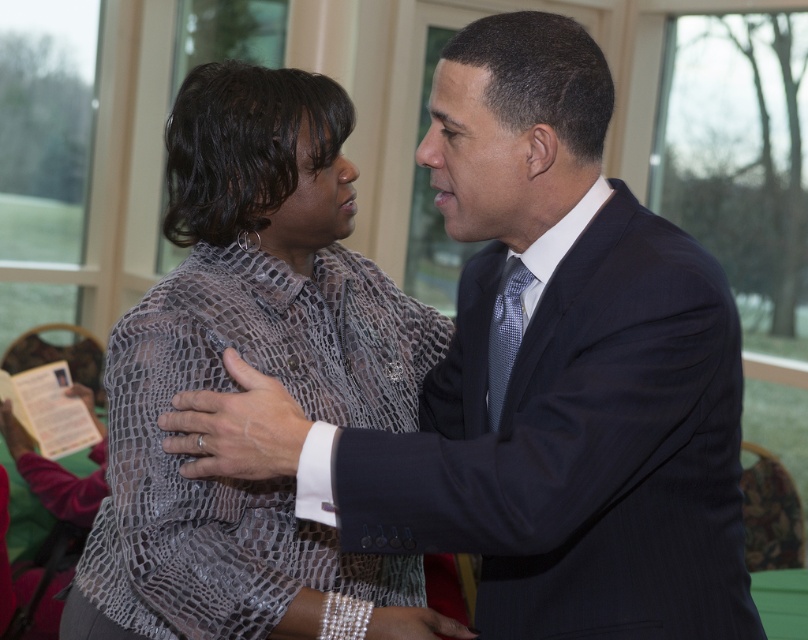
Question: Does dark blue suit at center appear on the right side of matte snakeskin blouse at center?

Choices:
 (A) yes
 (B) no

Answer: (A)

Question: Which point is closer to the camera?

Choices:
 (A) matte snakeskin blouse at center
 (B) silvery textured tie at center
 (C) dark blue suit at center

Answer: (C)

Question: Which of the following is the farthest from the observer?

Choices:
 (A) (221, 298)
 (B) (280, 404)
 (C) (495, 413)

Answer: (A)

Question: Can you confirm if matte snakeskin blouse at center is wider than silvery textured tie at center?

Choices:
 (A) yes
 (B) no

Answer: (A)

Question: Which point appears farthest from the camera in this image?

Choices:
 (A) (423, 157)
 (B) (512, 356)

Answer: (B)

Question: Is dark blue suit at center bigger than silvery textured tie at center?

Choices:
 (A) yes
 (B) no

Answer: (A)